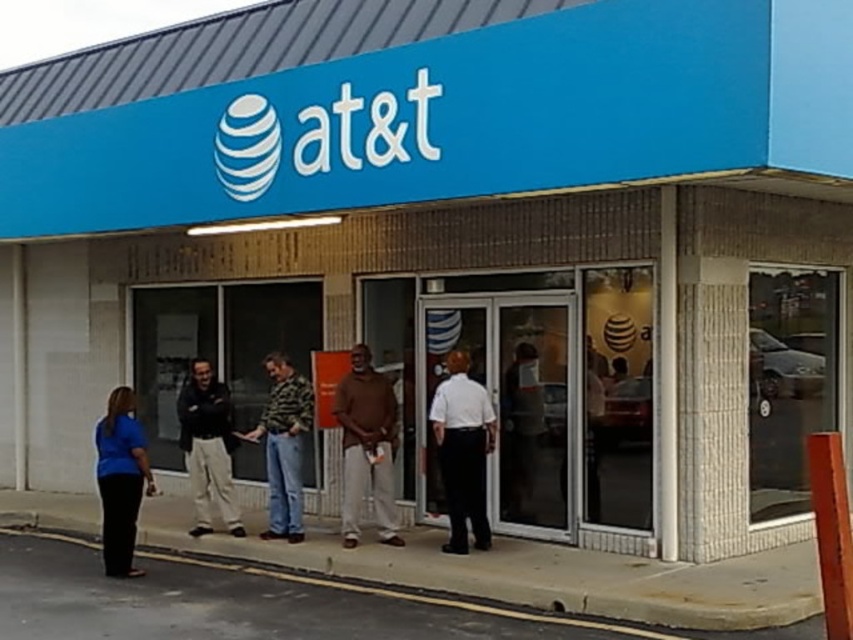
Question: Which point is farther from the camera taking this photo?

Choices:
 (A) (135, 573)
 (B) (358, 499)

Answer: (B)

Question: Which object is the closest to the white shirt at center?

Choices:
 (A) brown cotton shirt at center
 (B) camouflage jacket at center
 (C) black pants at lower left

Answer: (A)

Question: Is dark gray sweater at center to the left of black pants at lower left from the viewer's perspective?

Choices:
 (A) no
 (B) yes

Answer: (B)

Question: Which point is closer to the camera?

Choices:
 (A) (384, 518)
 (B) (596, 621)

Answer: (B)

Question: Can you confirm if brown cotton shirt at center is positioned above black pants at lower left?

Choices:
 (A) no
 (B) yes

Answer: (B)

Question: Does white shirt at center appear on the left side of camouflage jacket at center?

Choices:
 (A) no
 (B) yes

Answer: (A)